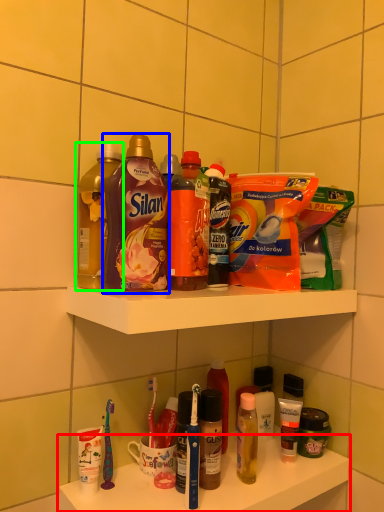
Question: Which object is positioned closest to supermarket shelf (highlighted by a red box)? Select from bottle (highlighted by a blue box) and bottle (highlighted by a green box).

Choices:
 (A) bottle
 (B) bottle

Answer: (A)